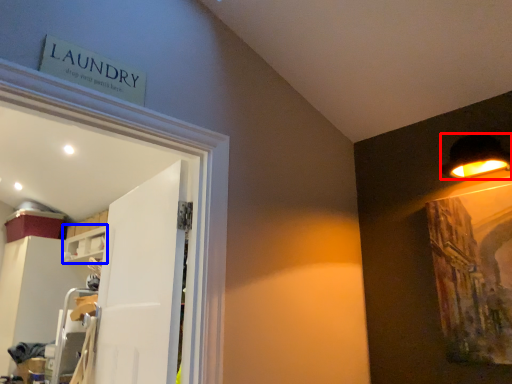
Question: Which object appears farthest to the camera in this image, lamp (highlighted by a red box) or shelf (highlighted by a blue box)?

Choices:
 (A) lamp
 (B) shelf

Answer: (B)